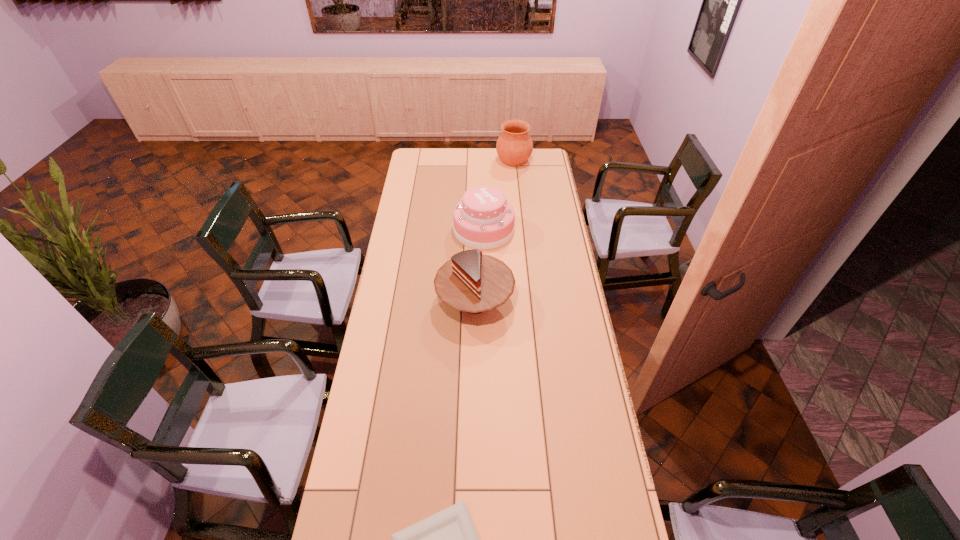
Where is `the farthest object`? The width and height of the screenshot is (960, 540). the farthest object is located at coordinates (514, 146).

Identify the location of the second nearest object. The image size is (960, 540). (471, 282).

This screenshot has width=960, height=540. Identify the location of the third nearest object. (483, 219).

At what (x,y) coordinates should I click in order to perform the action: click on free space located on the front of the farthest object. Please return your answer as a coordinate pair (x, y). The image size is (960, 540). Looking at the image, I should click on point(516,183).

Locate an element on the screen. free point located 0.080m on the front of the third farthest object is located at coordinates (474, 350).

You are a GUI agent. You are given a task and a screenshot of the screen. Output one action in this format:
    pyautogui.click(x=<x>, y=<y>)
    Task: Click on the free space located 0.130m on the right of the farthest cake
    The height and width of the screenshot is (540, 960).
    Given the screenshot: What is the action you would take?
    pyautogui.click(x=540, y=230)

Where is `object at the far edge`? The height and width of the screenshot is (540, 960). object at the far edge is located at coordinates (514, 146).

Identify the location of object positioned at the right edge. (514, 146).

At what (x,y) coordinates should I click in order to perform the action: click on object that is positioned at the far right corner. Please return your answer as a coordinate pair (x, y). Looking at the image, I should click on (514, 146).

Find the location of a particular element. free space at the far edge of the desktop is located at coordinates (466, 151).